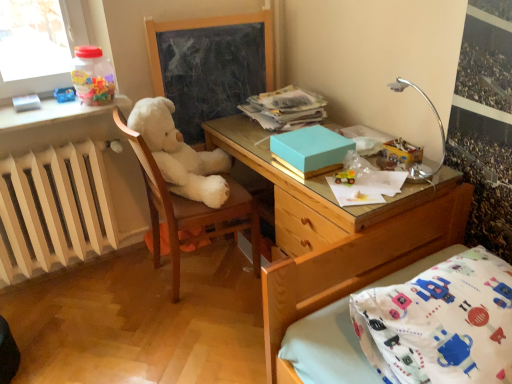
What are the coordinates of `vacant area that is in front of yellow rubber toy car at center, which appears as the 1th toy when viewed from the front` in the screenshot? It's located at (355, 195).